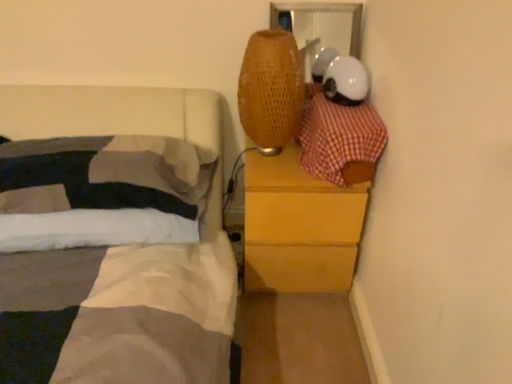
Question: From their relative heights in the image, would you say red checkered fabric at upper right is taller or shorter than wooden chest of drawers at right?

Choices:
 (A) short
 (B) tall

Answer: (A)

Question: In the image, is red checkered fabric at upper right on the left side or the right side of wooden chest of drawers at right?

Choices:
 (A) left
 (B) right

Answer: (B)

Question: Which object is positioned closest to the wooden chest of drawers at right?

Choices:
 (A) white soft pillow at left
 (B) red checkered fabric at upper right

Answer: (B)

Question: Considering the real-world distances, which object is farthest from the red checkered fabric at upper right?

Choices:
 (A) wooden chest of drawers at right
 (B) white soft pillow at left

Answer: (B)